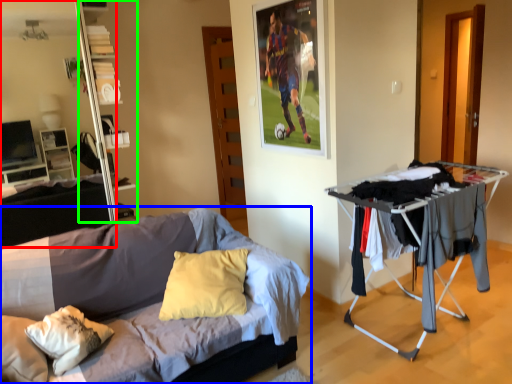
Question: Estimate the real-world distances between objects in this image. Which object is closer to entertainment center (highlighted by a red box), bed (highlighted by a blue box) or shelf (highlighted by a green box)?

Choices:
 (A) bed
 (B) shelf

Answer: (B)